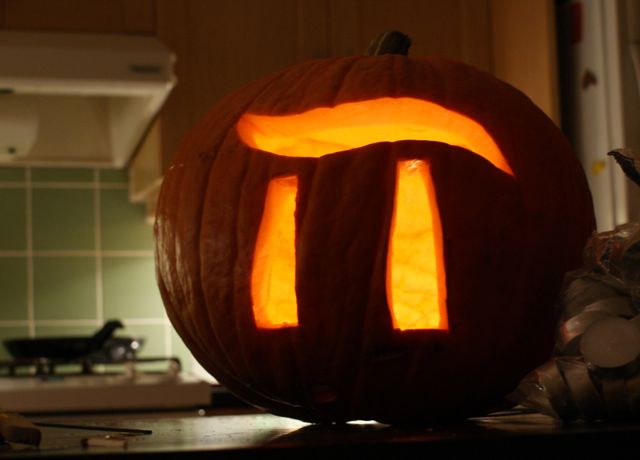
You are a GUI agent. You are given a task and a screenshot of the screen. Output one action in this format:
    pyautogui.click(x=<x>, y=<y>)
    Task: Click on the stove top
    Image resolution: width=640 pixels, height=460 pixels.
    Given the screenshot: What is the action you would take?
    pyautogui.click(x=58, y=390)